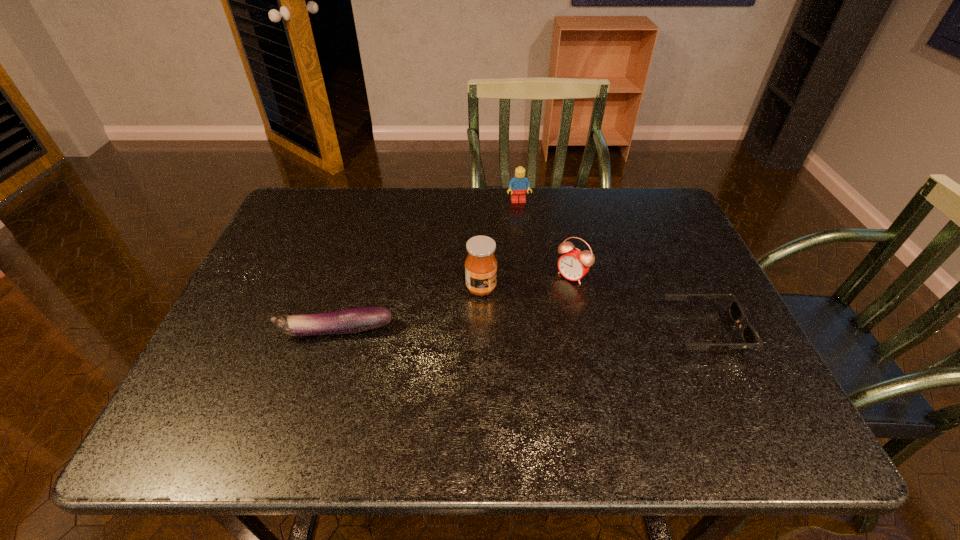
This screenshot has height=540, width=960. In order to click on vacant space on the desktop that is between the second shortest object and the rightmost object and is positioned on the front-facing side of the tallest object in this screenshot , I will do `click(563, 331)`.

Find the location of a particular element. The image size is (960, 540). free space on the desktop that is between the eggplant and the rightmost object and is positioned on the clock face of the alarm clock is located at coordinates (519, 331).

Where is `vacant spot on the desktop that is between the fourth tallest object and the shortest object and is positioned on the face of the farthest object`? This screenshot has height=540, width=960. vacant spot on the desktop that is between the fourth tallest object and the shortest object and is positioned on the face of the farthest object is located at coordinates (552, 331).